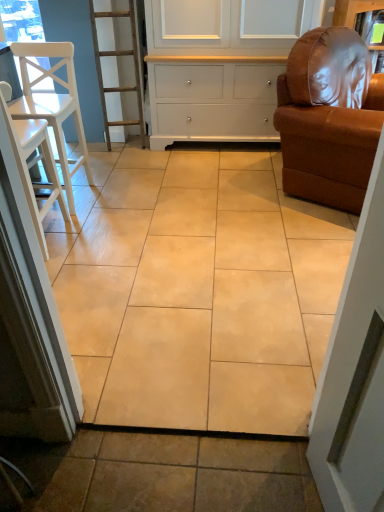
Question: Does white wood chair at left, the second chair viewed from the right, contain white painted wood cabinet at upper center?

Choices:
 (A) yes
 (B) no

Answer: (B)

Question: Considering the relative sizes of white wood chair at left, the second chair when ordered from left to right, and white painted wood cabinet at upper center in the image provided, is white wood chair at left, the second chair when ordered from left to right, bigger than white painted wood cabinet at upper center?

Choices:
 (A) yes
 (B) no

Answer: (B)

Question: Is white wood chair at left, the second chair when ordered from left to right, positioned far away from white painted wood cabinet at upper center?

Choices:
 (A) no
 (B) yes

Answer: (B)

Question: From the image's perspective, is white wood chair at left, the second chair viewed from the right, on white painted wood cabinet at upper center?

Choices:
 (A) no
 (B) yes

Answer: (A)

Question: Can you confirm if white wood chair at left, the second chair when ordered from left to right, is thinner than white painted wood cabinet at upper center?

Choices:
 (A) yes
 (B) no

Answer: (A)

Question: Considering their positions, is white wood chair at left, the second chair viewed from the right, located in front of or behind beige ceramic tile at center?

Choices:
 (A) behind
 (B) front

Answer: (A)

Question: From a real-world perspective, relative to beige ceramic tile at center, is white wood chair at left, the second chair when ordered from left to right, vertically above or below?

Choices:
 (A) below
 (B) above

Answer: (B)

Question: Would you say white wood chair at left, the second chair viewed from the right, is to the left or to the right of beige ceramic tile at center in the picture?

Choices:
 (A) left
 (B) right

Answer: (A)

Question: Is white wood chair at left, the second chair when ordered from left to right, wider or thinner than beige ceramic tile at center?

Choices:
 (A) thin
 (B) wide

Answer: (A)

Question: Is white painted wood cabinet at upper center in front of or behind white wood chair at left, the 3th chair from the right, in the image?

Choices:
 (A) front
 (B) behind

Answer: (B)

Question: From the image's perspective, is white painted wood cabinet at upper center above or below white wood chair at left, the 3th chair from the right?

Choices:
 (A) below
 (B) above

Answer: (B)

Question: Considering the positions of white painted wood cabinet at upper center and white wood chair at left, which is counted as the 1th chair, starting from the left, in the image, is white painted wood cabinet at upper center taller or shorter than white wood chair at left, which is counted as the 1th chair, starting from the left,?

Choices:
 (A) short
 (B) tall

Answer: (B)

Question: From a real-world perspective, is white painted wood cabinet at upper center positioned above or below white wood chair at left, which is counted as the 1th chair, starting from the left?

Choices:
 (A) below
 (B) above

Answer: (B)

Question: Considering the positions of white wood chair at left, the 3th chair from the right, and white wood chair at left, the second chair when ordered from left to right, in the image, is white wood chair at left, the 3th chair from the right, bigger or smaller than white wood chair at left, the second chair when ordered from left to right,?

Choices:
 (A) big
 (B) small

Answer: (A)

Question: Is white wood chair at left, the 3th chair from the right, in front of or behind white wood chair at left, the second chair when ordered from left to right, in the image?

Choices:
 (A) behind
 (B) front

Answer: (A)